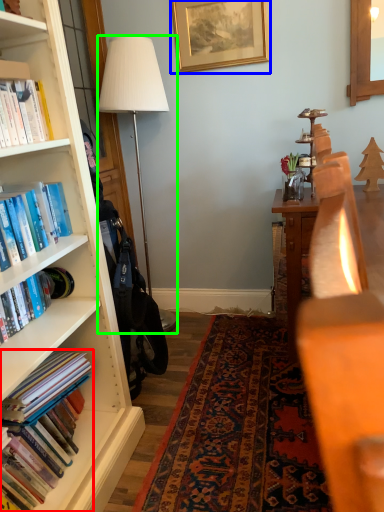
Question: Which is nearer to the book (highlighted by a red box)? picture frame (highlighted by a blue box) or lamp (highlighted by a green box).

Choices:
 (A) picture frame
 (B) lamp

Answer: (B)